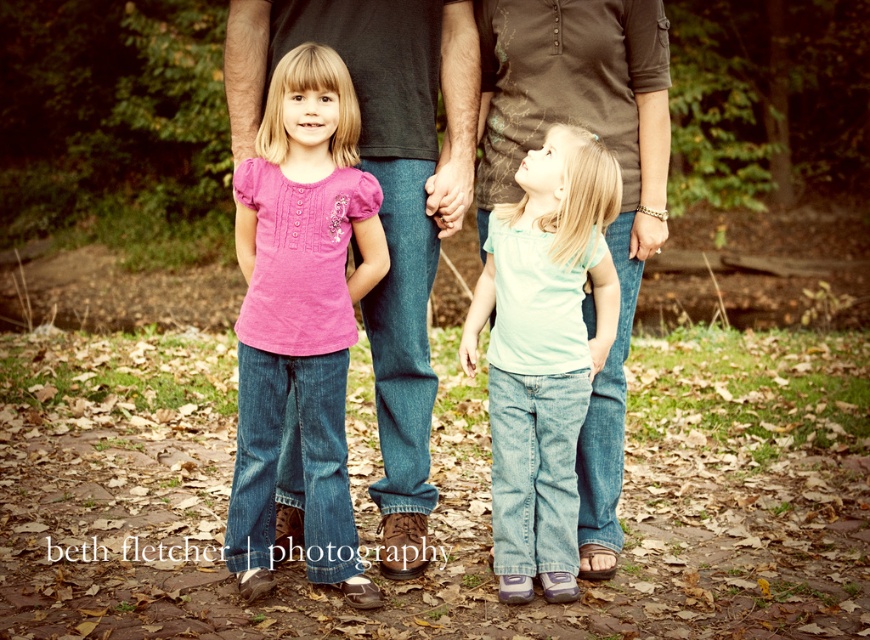
Question: Where is matte black shirt at center located in relation to light blue denim jeans at center in the image?

Choices:
 (A) below
 (B) above

Answer: (B)

Question: Which point is farther from the camera taking this photo?

Choices:
 (A) (278, 513)
 (B) (599, 355)

Answer: (A)

Question: Which point appears closest to the camera in this image?

Choices:
 (A) (540, 545)
 (B) (412, 566)

Answer: (A)

Question: Does matte black shirt at center appear under light blue denim jeans at center?

Choices:
 (A) yes
 (B) no

Answer: (B)

Question: Can you confirm if matte black shirt at center is positioned below light blue denim jeans at center?

Choices:
 (A) no
 (B) yes

Answer: (A)

Question: Among these points, which one is nearest to the camera?

Choices:
 (A) (386, 64)
 (B) (494, 488)

Answer: (B)